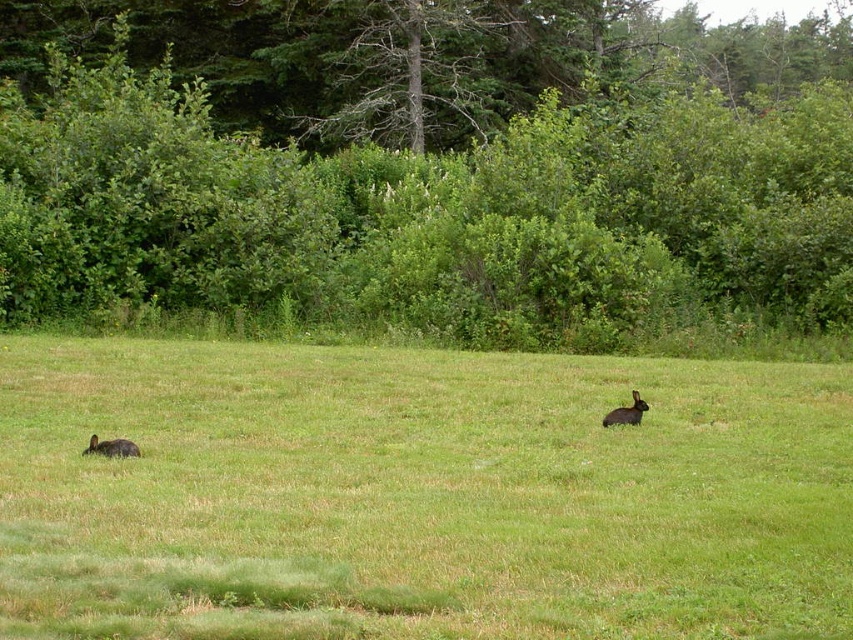
You are standing in the middle of the green grassy field at center and want to find the fuzzy brown rabbit at lower left. Which direction should you walk to locate it?

The fuzzy brown rabbit at lower left is located to the left of the green grassy field at center, so you should walk to the left to find it.